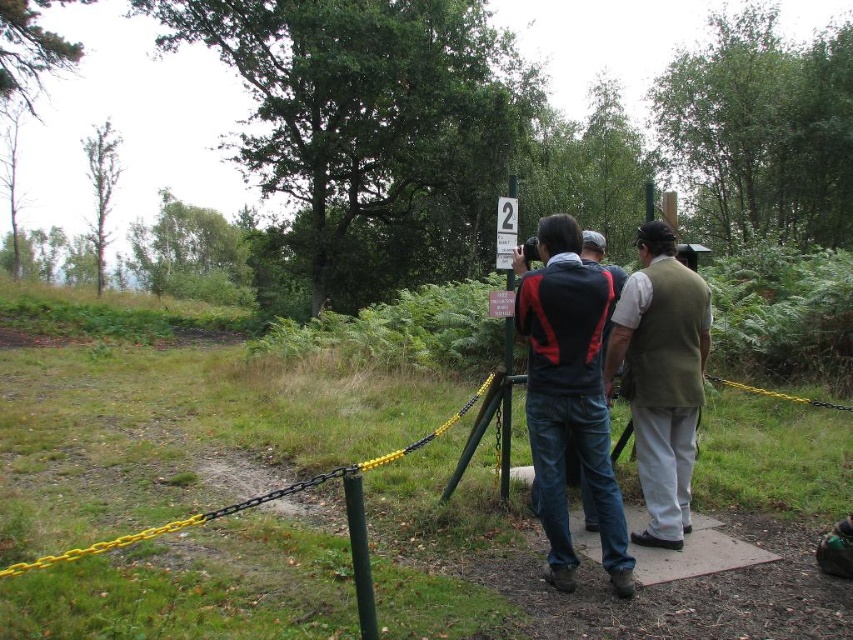
Who is more distant from viewer, (538, 323) or (498, 256)?

The point (498, 256) is behind.

The height and width of the screenshot is (640, 853). In order to click on dark blue jacket at center in this screenshot , I will do `click(569, 394)`.

Who is more forward, (x=666, y=308) or (x=505, y=384)?

Point (x=666, y=308)

From the picture: Is khaki cotton vest at center shorter than green metallic pole at center?

Yes, khaki cotton vest at center is shorter than green metallic pole at center.

Is point (666, 298) farther from viewer compared to point (514, 179)?

No, it is not.

This screenshot has height=640, width=853. Identify the location of khaki cotton vest at center. (660, 376).

Does dark blue jacket at center appear on the left side of khaki cotton vest at center?

Yes, dark blue jacket at center is to the left of khaki cotton vest at center.

Is dark blue jacket at center wider than khaki cotton vest at center?

Yes, dark blue jacket at center is wider than khaki cotton vest at center.

At what (x,y) coordinates should I click in order to perform the action: click on dark blue jacket at center. Please return your answer as a coordinate pair (x, y). Looking at the image, I should click on (569, 394).